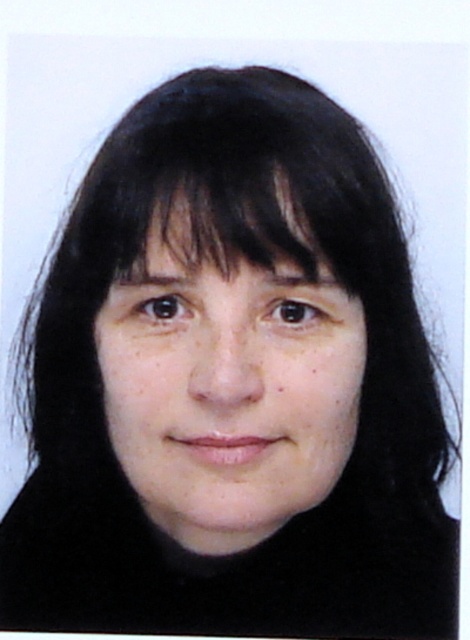
Question: Which object is farther from the camera taking this photo?

Choices:
 (A) black matte hair at upper center
 (B) smooth skin face at center

Answer: (A)

Question: Which of the following is the farthest from the observer?

Choices:
 (A) (320, 432)
 (B) (266, 225)

Answer: (A)

Question: Is smooth skin face at center thinner than black matte hair at upper center?

Choices:
 (A) no
 (B) yes

Answer: (A)

Question: Does smooth skin face at center appear on the right side of black matte hair at upper center?

Choices:
 (A) yes
 (B) no

Answer: (A)

Question: Does smooth skin face at center appear over black matte hair at upper center?

Choices:
 (A) yes
 (B) no

Answer: (B)